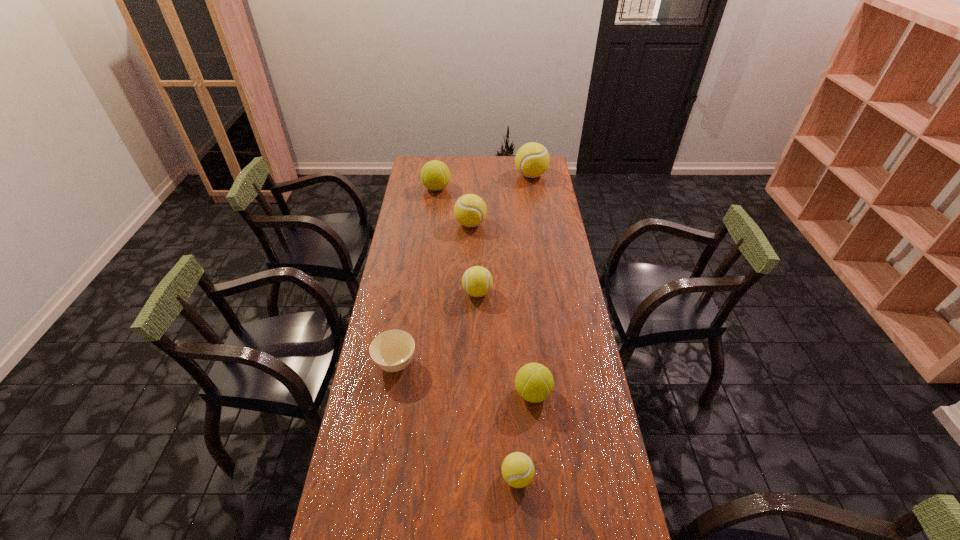
This screenshot has width=960, height=540. I want to click on vacant point located between the third farthest yellow tennis ball and the biggest yellow tennis ball, so click(504, 234).

Where is `free space that is in between the fourth farthest tennis ball and the fourth nearest tennis ball`? free space that is in between the fourth farthest tennis ball and the fourth nearest tennis ball is located at coordinates (474, 258).

Select which object is the fourth closest to the sugar bowl. Please provide its 2D coordinates. Your answer should be formatted as a tuple, i.e. [(x, y)], where the tuple contains the x and y coordinates of a point satisfying the conditions above.

[(470, 210)]

Where is `object that can be found as the second closest to the sugar bowl`? Image resolution: width=960 pixels, height=540 pixels. object that can be found as the second closest to the sugar bowl is located at coordinates (534, 382).

Identify which tennis ball is the second closest to the third biggest yellow tennis ball. Please provide its 2D coordinates. Your answer should be formatted as a tuple, i.e. [(x, y)], where the tuple contains the x and y coordinates of a point satisfying the conditions above.

[(534, 382)]

At what (x,y) coordinates should I click in order to perform the action: click on tennis ball that is the fourth closest one to the right green tennis ball. Please return your answer as a coordinate pair (x, y). The width and height of the screenshot is (960, 540). Looking at the image, I should click on (435, 175).

You are a GUI agent. You are given a task and a screenshot of the screen. Output one action in this format:
    pyautogui.click(x=<x>, y=<y>)
    Task: Click on the yellow tennis ball that is the second closest to the fourth farthest tennis ball
    The height and width of the screenshot is (540, 960).
    Given the screenshot: What is the action you would take?
    pyautogui.click(x=518, y=470)

Identify the location of yellow tennis ball that is the third closest to the third smallest yellow tennis ball. (518, 470).

You are a GUI agent. You are given a task and a screenshot of the screen. Output one action in this format:
    pyautogui.click(x=<x>, y=<y>)
    Task: Click on the green tennis ball object that ranks as the closest to the rightmost yellow tennis ball
    The width and height of the screenshot is (960, 540).
    Given the screenshot: What is the action you would take?
    pyautogui.click(x=435, y=175)

The height and width of the screenshot is (540, 960). Identify the location of vacant space that satisfies the following two spatial constraints: 1. on the front side of the smaller green tennis ball; 2. on the left side of the second smallest yellow tennis ball. point(477,393).